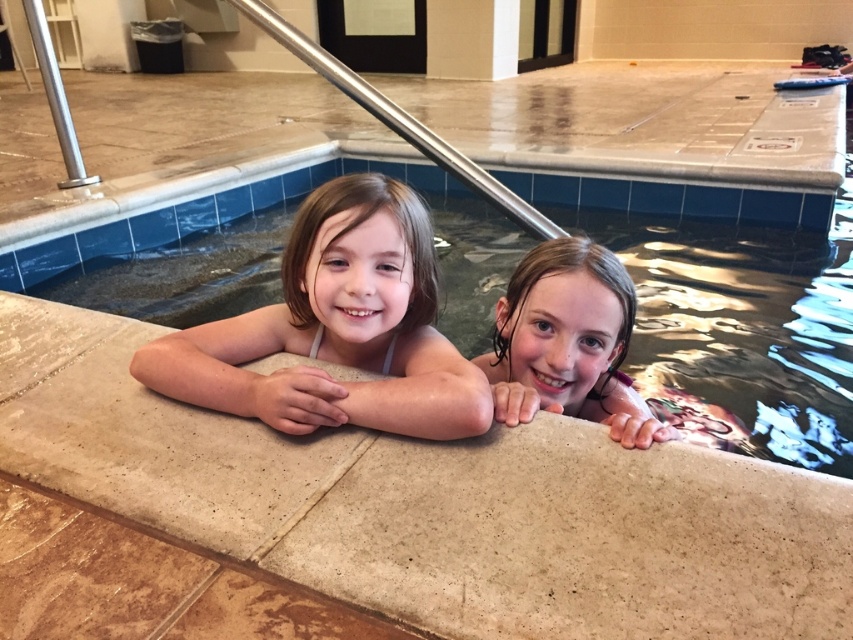
Looking at this image, can you confirm if beige stone ledge at center is taller than wet hair at upper right?

Yes.

Based on the photo, between beige stone ledge at center and wet hair at upper right, which one appears on the right side from the viewer's perspective?

From the viewer's perspective, wet hair at upper right appears more on the right side.

This screenshot has height=640, width=853. I want to click on beige stone ledge at center, so click(x=433, y=504).

Does beige stone ledge at center have a smaller size compared to smooth concrete pool at center?

Correct, beige stone ledge at center occupies less space than smooth concrete pool at center.

Can you confirm if beige stone ledge at center is positioned below smooth concrete pool at center?

Yes.

Which is in front, point (820, 545) or point (287, 179)?

Point (820, 545) is more forward.

Identify the location of beige stone ledge at center. (433, 504).

Between point (363, 241) and point (595, 317), which one is positioned in front?

Point (363, 241) is in front.

In the scene shown: Can you confirm if smooth skin child at center is shorter than wet hair at upper right?

In fact, smooth skin child at center may be taller than wet hair at upper right.

At what (x,y) coordinates should I click in order to perform the action: click on smooth skin child at center. Please return your answer as a coordinate pair (x, y). This screenshot has width=853, height=640. Looking at the image, I should click on (335, 328).